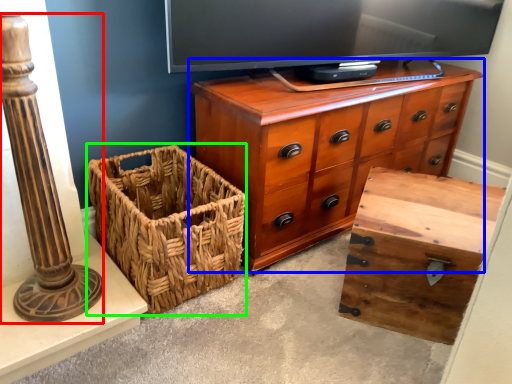
Question: Considering the real-world distances, which object is closest to pillar (highlighted by a red box)? chest of drawers (highlighted by a blue box) or basket (highlighted by a green box).

Choices:
 (A) chest of drawers
 (B) basket

Answer: (B)